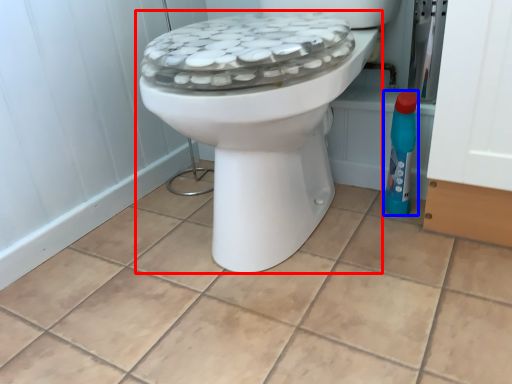
Question: Among these objects, which one is nearest to the camera, toilet (highlighted by a red box) or cleaning product (highlighted by a blue box)?

Choices:
 (A) toilet
 (B) cleaning product

Answer: (A)